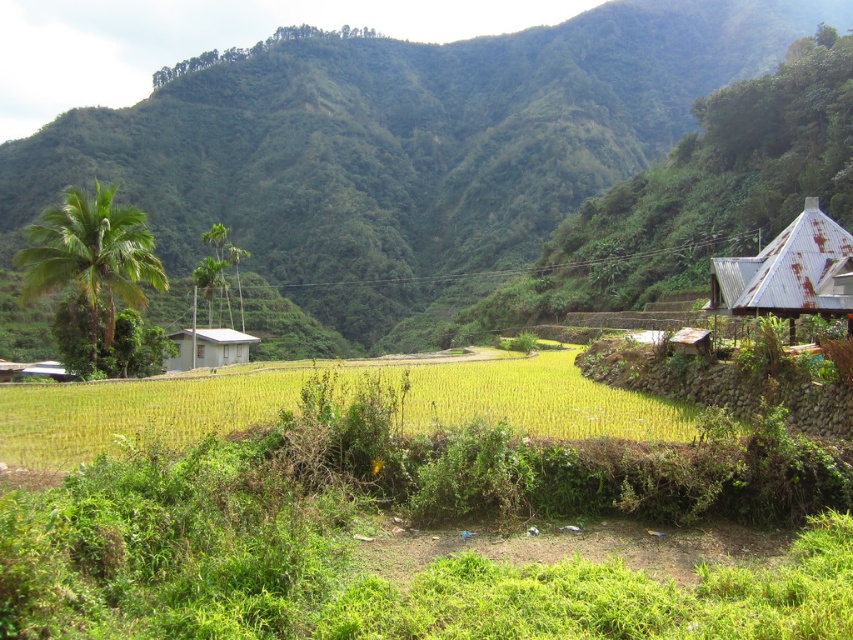
Question: Estimate the real-world distances between objects in this image. Which object is closer to the green leafy mountain at upper center?

Choices:
 (A) yellow-green grass at center
 (B) rusty metal hut at right

Answer: (A)

Question: In this image, where is green leafy mountain at upper center located relative to yellow-green grass at center?

Choices:
 (A) below
 (B) above

Answer: (B)

Question: Which object appears closest to the camera in this image?

Choices:
 (A) rusty metal hut at right
 (B) yellow-green grass at center
 (C) white corrugated metal hut at center
 (D) green leafy mountain at upper center

Answer: (B)

Question: Does yellow-green grass at center come behind rusty metal hut at right?

Choices:
 (A) yes
 (B) no

Answer: (B)

Question: Which point is farther from the camera taking this photo?

Choices:
 (A) (672, 429)
 (B) (397, 282)
 (C) (178, 362)

Answer: (B)

Question: Can you confirm if green leafy mountain at upper center is positioned below yellow-green grass at center?

Choices:
 (A) no
 (B) yes

Answer: (A)